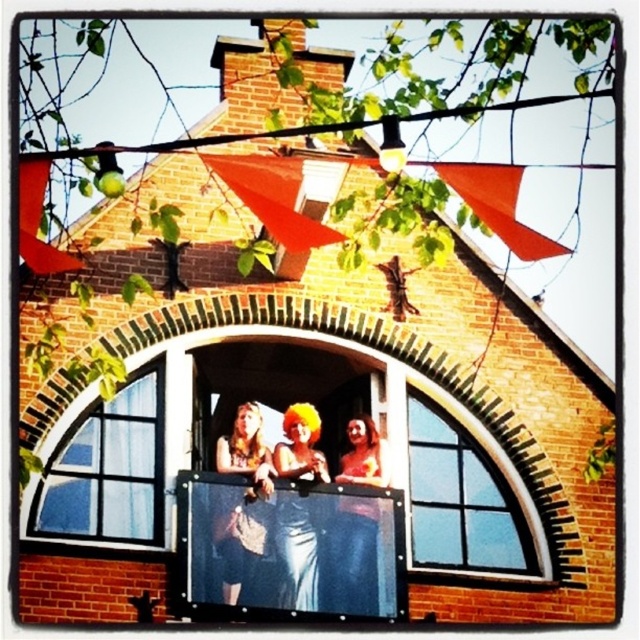
Who is positioned more to the right, denim skirt at center or orange wig at center?

From the viewer's perspective, orange wig at center appears more on the right side.

Is point (260, 483) positioned before point (300, 576)?

No, (260, 483) is further to viewer.

The image size is (640, 640). Identify the location of denim skirt at center. click(x=243, y=499).

Between clear glass window at center and denim skirt at center, which one appears on the right side from the viewer's perspective?

From the viewer's perspective, clear glass window at center appears more on the right side.

Is clear glass window at center smaller than denim skirt at center?

No, clear glass window at center is not smaller than denim skirt at center.

Is point (465, 488) behind point (244, 464)?

Yes.

The height and width of the screenshot is (640, 640). I want to click on clear glass window at center, so click(x=460, y=499).

Can you confirm if denim skirt at center is taller than matte blue jeans at center?

Yes, denim skirt at center is taller than matte blue jeans at center.

Based on the photo, who is more distant from viewer, (216, 451) or (374, 433)?

Positioned behind is point (374, 433).

This screenshot has width=640, height=640. In order to click on denim skirt at center in this screenshot , I will do `click(243, 499)`.